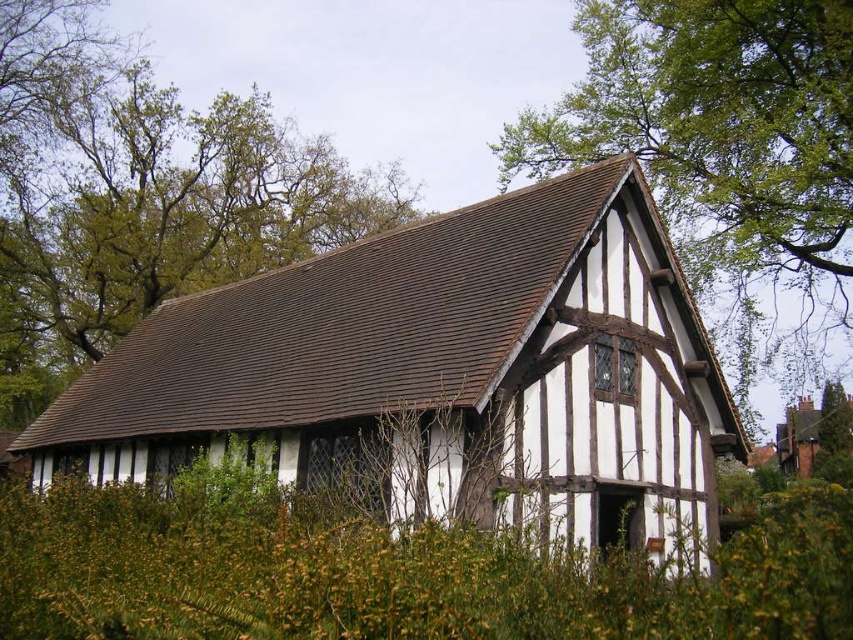
Between point (13, 292) and point (654, 129), which one is positioned in front?

Point (654, 129) is more forward.

Does green leafy tree at upper center appear on the left side of green leafy tree at upper right?

Yes, green leafy tree at upper center is to the left of green leafy tree at upper right.

Does point (67, 362) lie behind point (750, 342)?

Yes, point (67, 362) is farther from viewer.

Locate an element on the screen. Image resolution: width=853 pixels, height=640 pixels. green leafy tree at upper center is located at coordinates (141, 196).